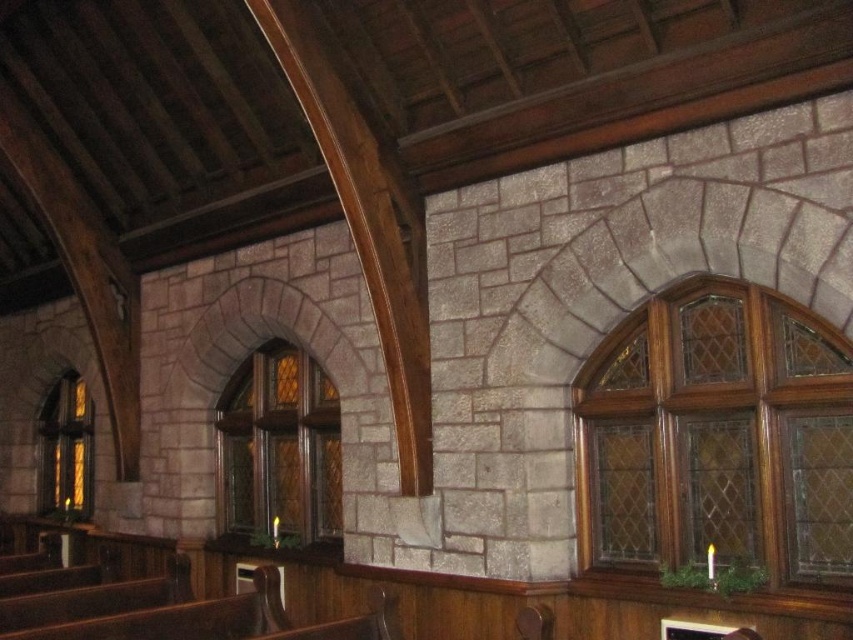
Which is more to the left, stained glass window at center or stained glass window at left?

Positioned to the left is stained glass window at left.

How much distance is there between stained glass window at center and stained glass window at left?

They are 3.24 meters apart.

Is point (334, 396) closer to camera compared to point (41, 477)?

Yes, point (334, 396) is in front of point (41, 477).

The image size is (853, 640). I want to click on stained glass window at center, so click(280, 445).

Describe the element at coordinates (717, 436) in the screenshot. I see `stained glass window at upper right` at that location.

Is point (619, 520) positioned before point (74, 372)?

That is True.

Where is `stained glass window at upper right`? stained glass window at upper right is located at coordinates (717, 436).

Can you confirm if stained glass window at upper right is wider than stained glass window at center?

No.

Which of these two, stained glass window at upper right or stained glass window at center, stands taller?

With more height is stained glass window at upper right.

Where is `stained glass window at upper right`? This screenshot has height=640, width=853. stained glass window at upper right is located at coordinates (717, 436).